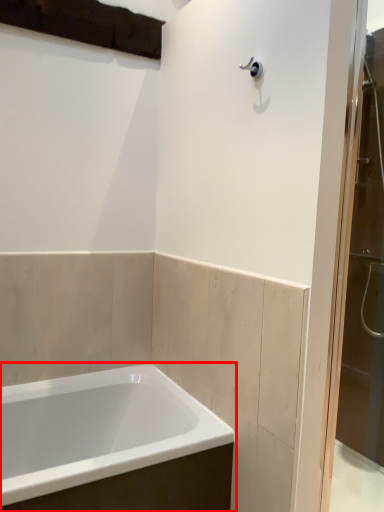
Question: From the image, what is the correct spatial relationship of bathtub (annotated by the red box) in relation to screen door?

Choices:
 (A) right
 (B) left

Answer: (B)